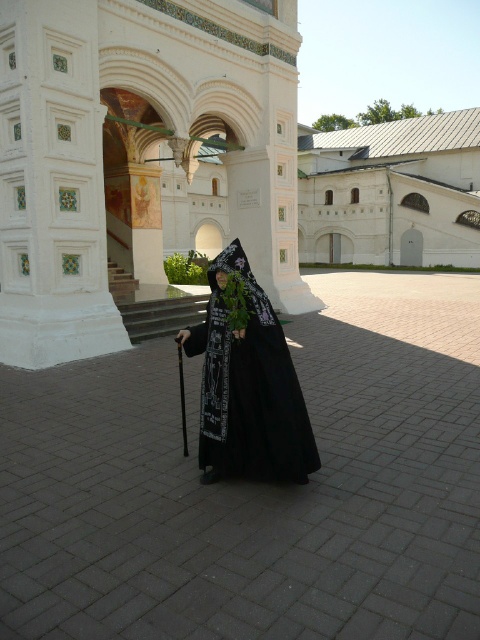
Question: In this image, where is black fabric courtyard at center located relative to black matte/velvet cloak at center?

Choices:
 (A) above
 (B) below

Answer: (B)

Question: Which point appears closest to the camera in this image?

Choices:
 (A) (228, 308)
 (B) (327, 304)
 (C) (425, 118)

Answer: (A)

Question: Which point appears closest to the camera in this image?

Choices:
 (A) (374, 179)
 (B) (245, 352)

Answer: (B)

Question: Does black fabric courtyard at center appear over white smooth building at center?

Choices:
 (A) yes
 (B) no

Answer: (B)

Question: Which point appears closest to the camera in this image?

Choices:
 (A) (264, 301)
 (B) (356, 300)
 (C) (368, 227)

Answer: (A)

Question: Where is black fabric courtyard at center located in relation to black matte/velvet cloak at center in the image?

Choices:
 (A) right
 (B) left

Answer: (B)